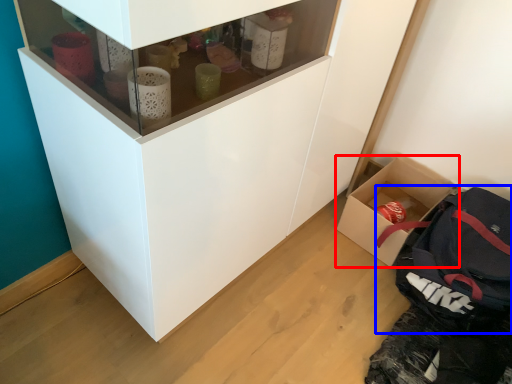
Question: Which of the following is the farthest to the observer, box (highlighted by a red box) or backpack (highlighted by a blue box)?

Choices:
 (A) box
 (B) backpack

Answer: (A)